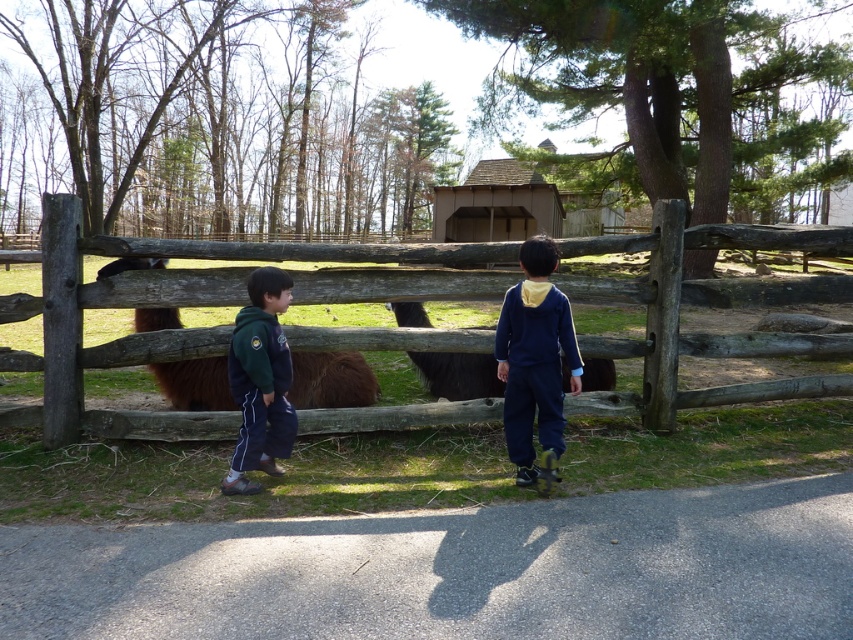
Question: Does brown wooden fence at center appear over dark brown woolly alpaca at center?

Choices:
 (A) no
 (B) yes

Answer: (B)

Question: Which object is the closest to the navy blue sweatshirt at center?

Choices:
 (A) brown fuzzy alpaca at center
 (B) green fleece jacket at center
 (C) dark brown woolly alpaca at center

Answer: (B)

Question: Which of the following is the closest to the observer?

Choices:
 (A) (321, 364)
 (B) (259, 467)
 (C) (463, 355)

Answer: (B)

Question: Among these objects, which one is farthest from the camera?

Choices:
 (A) brown wooden fence at center
 (B) brown fuzzy alpaca at center
 (C) green fleece jacket at center
 (D) dark brown woolly alpaca at center

Answer: (D)

Question: Does brown wooden fence at center appear on the left side of navy blue sweatshirt at center?

Choices:
 (A) yes
 (B) no

Answer: (B)

Question: Is navy blue sweatshirt at center smaller than green fleece jacket at center?

Choices:
 (A) yes
 (B) no

Answer: (B)